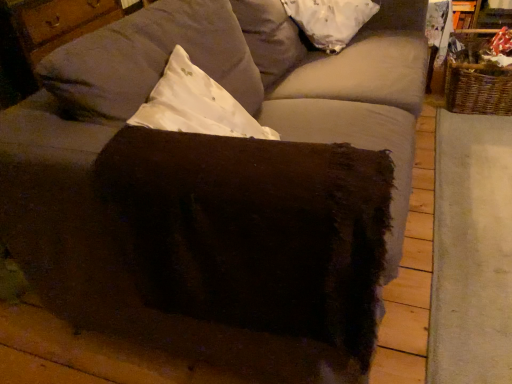
Question: Is white fabric pillow at upper center touching brown fuzzy ottoman at center?

Choices:
 (A) yes
 (B) no

Answer: (B)

Question: Considering the relative sizes of white fabric pillow at upper center and brown fuzzy ottoman at center in the image provided, is white fabric pillow at upper center smaller than brown fuzzy ottoman at center?

Choices:
 (A) yes
 (B) no

Answer: (A)

Question: Is brown fuzzy ottoman at center located within white fabric pillow at upper center?

Choices:
 (A) no
 (B) yes

Answer: (A)

Question: Does white fabric pillow at upper center have a lesser width compared to brown fuzzy ottoman at center?

Choices:
 (A) no
 (B) yes

Answer: (B)

Question: From a real-world perspective, is white fabric pillow at upper center located higher than brown fuzzy ottoman at center?

Choices:
 (A) no
 (B) yes

Answer: (B)

Question: Is white fabric pillow at upper center oriented towards brown fuzzy ottoman at center?

Choices:
 (A) yes
 (B) no

Answer: (B)

Question: Is woven brown basket at right inside white fabric pillow at upper center?

Choices:
 (A) no
 (B) yes

Answer: (A)

Question: Is white fabric pillow at upper center smaller than woven brown basket at right?

Choices:
 (A) yes
 (B) no

Answer: (A)

Question: From the image's perspective, is white fabric pillow at upper center on woven brown basket at right?

Choices:
 (A) yes
 (B) no

Answer: (A)

Question: Considering the relative sizes of white fabric pillow at upper center and woven brown basket at right in the image provided, is white fabric pillow at upper center thinner than woven brown basket at right?

Choices:
 (A) yes
 (B) no

Answer: (A)

Question: Does white fabric pillow at upper center have a greater height compared to woven brown basket at right?

Choices:
 (A) yes
 (B) no

Answer: (B)

Question: From a real-world perspective, is white fabric pillow at upper center over woven brown basket at right?

Choices:
 (A) yes
 (B) no

Answer: (A)

Question: Is woven brown basket at right wider than brown fuzzy ottoman at center?

Choices:
 (A) no
 (B) yes

Answer: (A)